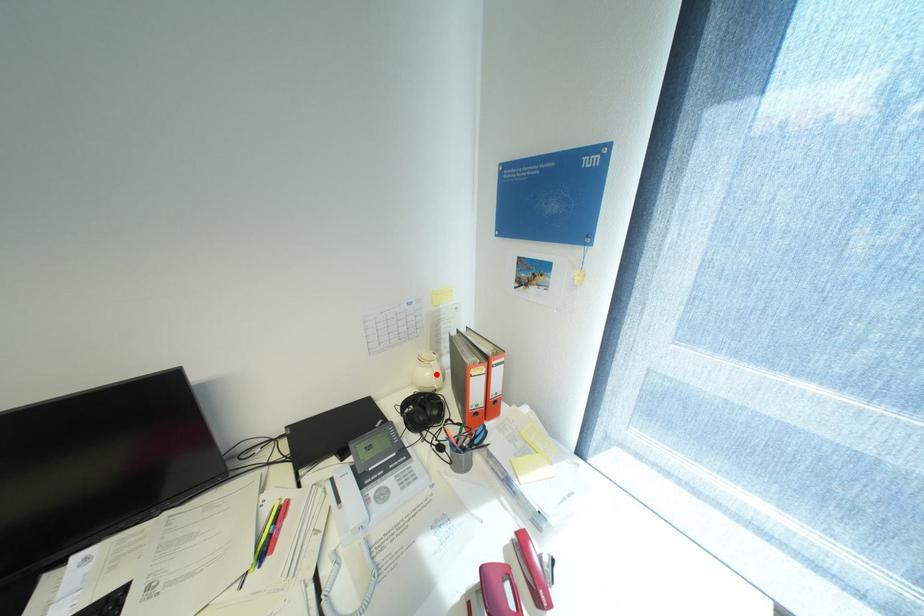
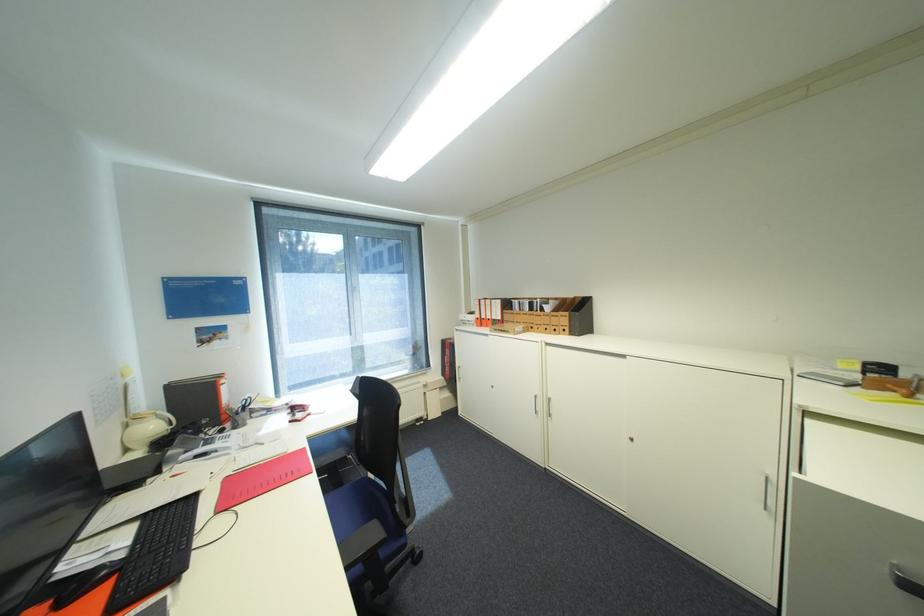
Find the pixel in the second image that matches the highlighted location in the first image.

(161, 427)